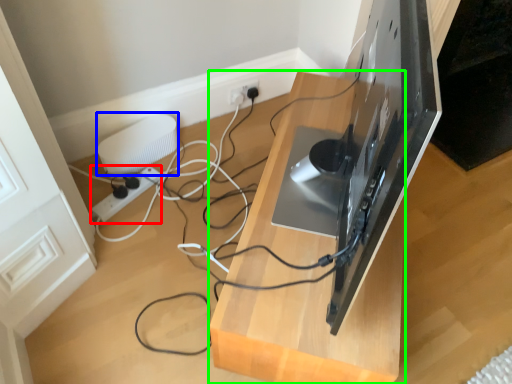
Question: Which is farther away from extension cord (highlighted by a red box)? appliance (highlighted by a blue box) or furniture (highlighted by a green box)?

Choices:
 (A) appliance
 (B) furniture

Answer: (B)